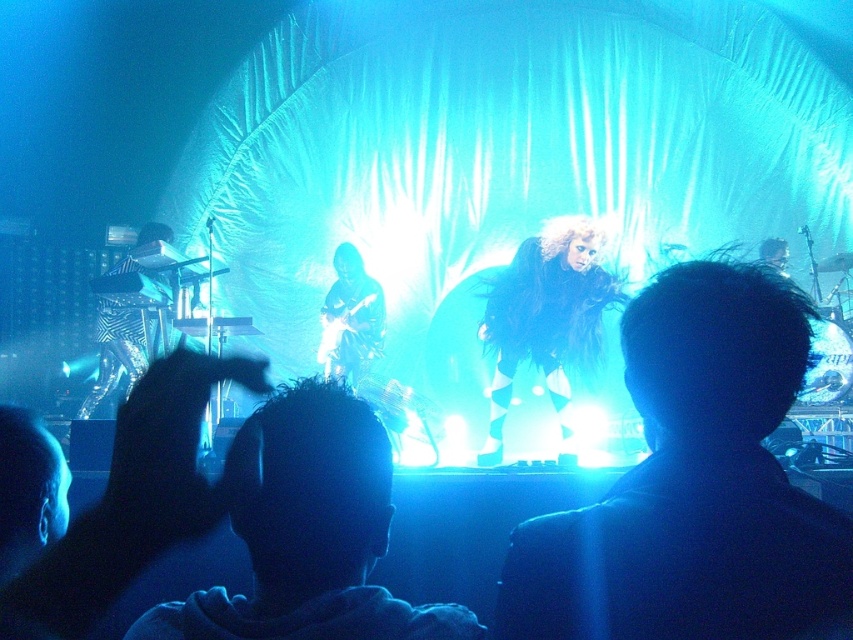
Question: Estimate the real-world distances between objects in this image. Which object is farther from the shiny black guitar at center?

Choices:
 (A) fuzzy black wig at center
 (B) fuzzy fur coat at center

Answer: (B)

Question: Can you confirm if fuzzy fur coat at center is wider than fuzzy black wig at center?

Choices:
 (A) no
 (B) yes

Answer: (A)

Question: Which of these objects is positioned closest to the fuzzy black wig at center?

Choices:
 (A) dark hair at center
 (B) fuzzy fur coat at center
 (C) shiny black guitar at center

Answer: (C)

Question: Observing the image, what is the correct spatial positioning of fuzzy fur coat at center in reference to dark hair at center?

Choices:
 (A) below
 (B) above

Answer: (B)

Question: Among these points, which one is nearest to the camera?

Choices:
 (A) (349, 284)
 (B) (712, 444)
 (C) (463, 614)

Answer: (B)

Question: Does dark hair at center come in front of shiny black guitar at center?

Choices:
 (A) no
 (B) yes

Answer: (B)